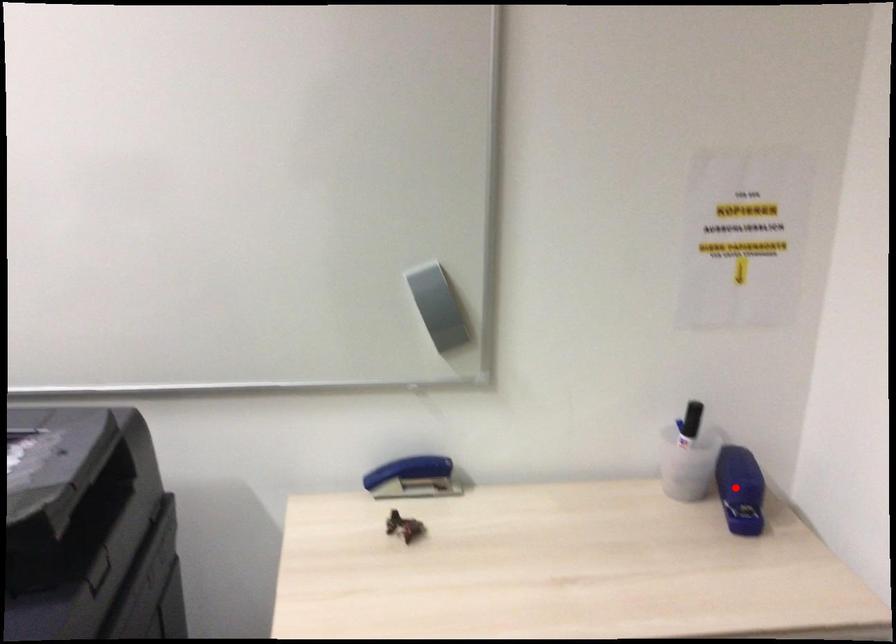
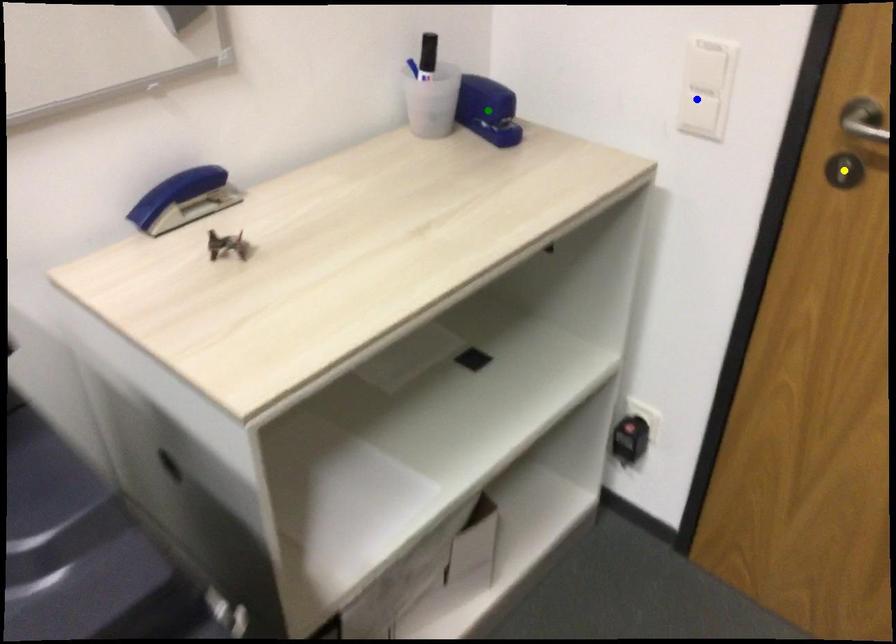
Question: I am providing you with two images of the same scene from different viewpoints. A red point is marked on the first image. You are given multiple points on the second image. Which point in image 2 is actually the same real-world point as the red point in image 1?

Choices:
 (A) blue point
 (B) yellow point
 (C) green point

Answer: (C)